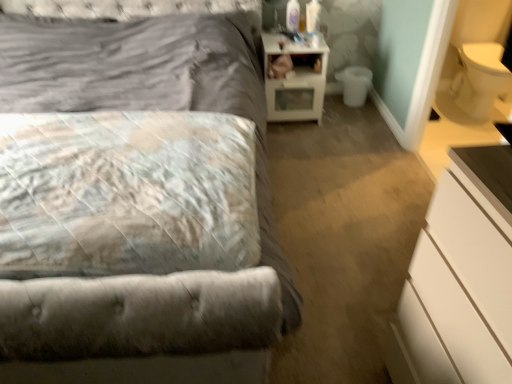
Question: Is the position of fluffy white pillow at left less distant than that of white glossy nightstand at upper right?

Choices:
 (A) yes
 (B) no

Answer: (A)

Question: Is fluffy white pillow at left positioned far away from white glossy nightstand at upper right?

Choices:
 (A) yes
 (B) no

Answer: (A)

Question: Is fluffy white pillow at left turned away from white glossy nightstand at upper right?

Choices:
 (A) yes
 (B) no

Answer: (B)

Question: Is fluffy white pillow at left taller than white glossy nightstand at upper right?

Choices:
 (A) yes
 (B) no

Answer: (B)

Question: Does fluffy white pillow at left have a larger size compared to white glossy nightstand at upper right?

Choices:
 (A) yes
 (B) no

Answer: (A)

Question: From their relative heights in the image, would you say white glossy nightstand at upper right is taller or shorter than white matte chest of drawers at lower right?

Choices:
 (A) short
 (B) tall

Answer: (A)

Question: In the image, is white glossy nightstand at upper right positioned in front of or behind white matte chest of drawers at lower right?

Choices:
 (A) front
 (B) behind

Answer: (B)

Question: Does point (291, 74) appear closer or farther from the camera than point (409, 340)?

Choices:
 (A) closer
 (B) farther

Answer: (B)

Question: Is white glossy nightstand at upper right inside or outside of white matte chest of drawers at lower right?

Choices:
 (A) inside
 (B) outside

Answer: (B)

Question: From the image's perspective, relative to fluffy white pillow at left, is white matte chest of drawers at lower right above or below?

Choices:
 (A) below
 (B) above

Answer: (A)

Question: Considering their positions, is white matte chest of drawers at lower right located in front of or behind fluffy white pillow at left?

Choices:
 (A) front
 (B) behind

Answer: (A)

Question: Is white matte chest of drawers at lower right inside the boundaries of fluffy white pillow at left, or outside?

Choices:
 (A) inside
 (B) outside

Answer: (B)

Question: In terms of height, does white matte chest of drawers at lower right look taller or shorter compared to fluffy white pillow at left?

Choices:
 (A) short
 (B) tall

Answer: (B)

Question: In terms of size, does velvet gray bed at center appear bigger or smaller than white glossy nightstand at upper right?

Choices:
 (A) small
 (B) big

Answer: (B)

Question: Considering the positions of point (86, 41) and point (304, 49), is point (86, 41) closer or farther from the camera than point (304, 49)?

Choices:
 (A) farther
 (B) closer

Answer: (B)